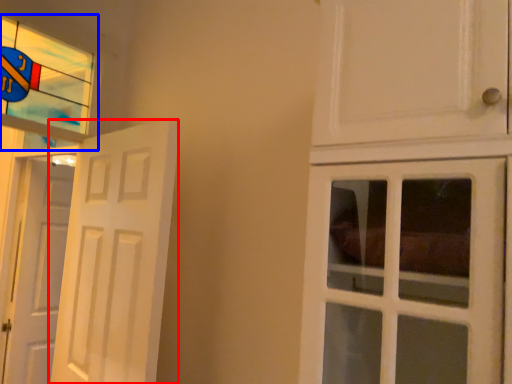
Question: Which object appears farthest to the camera in this image, door (highlighted by a red box) or window (highlighted by a blue box)?

Choices:
 (A) door
 (B) window

Answer: (B)